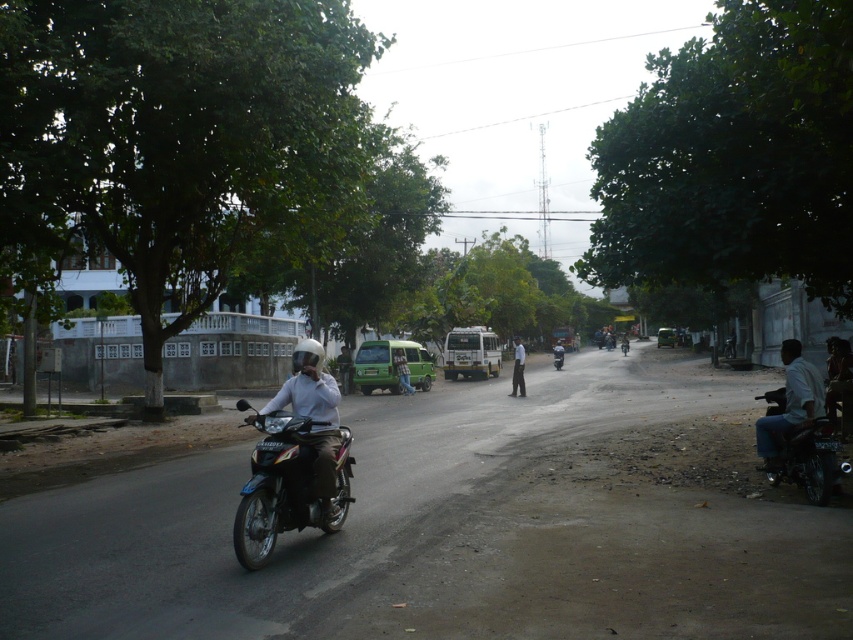
You are a photographer standing on the sidewalk and want to capture both the white matte shirt at center and the black glossy motorcycle at center in a single frame. Which object should you focus on first to ensure both are in the frame?

The white matte shirt at center is taller than the black glossy motorcycle at center, so you should focus on the white matte shirt at center first to ensure both are in the frame.

Consider the image. You are a delivery driver who needs to ensure your helmet fits securely on your motorcycle. Given the scene described, can you determine if the matte white helmet at center will fit on the black glossy motorcycle at center based on their sizes?

The matte white helmet at center occupies less space than the black glossy motorcycle at center, so it should fit securely on the motorcycle.

You are a pedestrian standing on the sidewalk and see the matte white helmet at center and the black glossy motorcycle at center. Which object is closer to your left side?

The matte white helmet at center is closer to your left side since it is positioned to the left of the black glossy motorcycle at center.